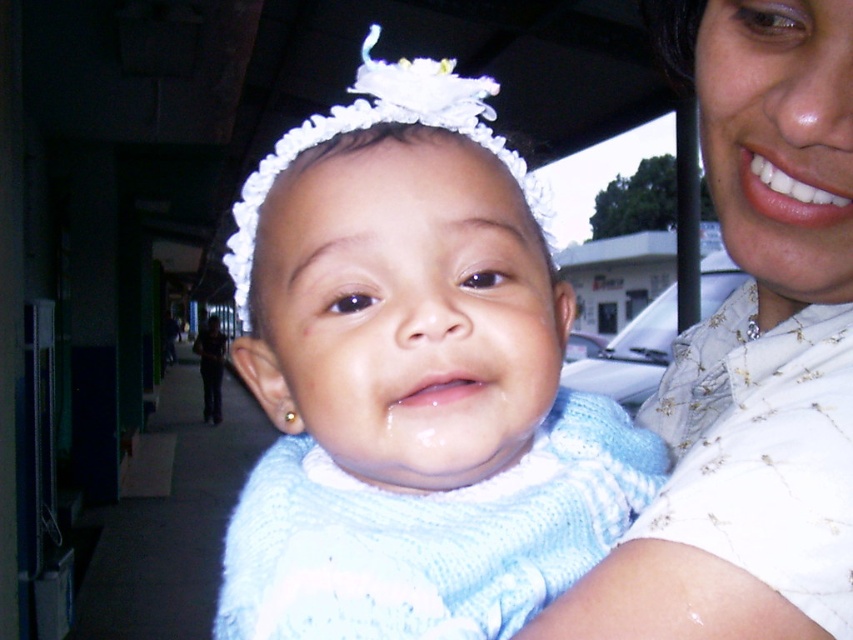
You are a photographer trying to capture the baby in focus while blurring the background. Since the light blue knitted sweater at center and the white quilted shirt at upper right are both in the scene, which one should you focus on to ensure the baby is sharp?

The light blue knitted sweater at center is in front of the white quilted shirt at upper right, so focusing on the light blue knitted sweater at center will keep the baby in sharp focus while blurring the background.

You are a photographer trying to capture a photo of the light blue knitted sweater at center and the white quilted shirt at upper right. Which object should you adjust your camera focus to first if you want to focus on the one closer to you?

The light blue knitted sweater at center is to the left of the white quilted shirt at upper right, but their distance from you isn

You are a photographer trying to capture the baby in the light blue knitted sweater at center. Where should you focus your camera to ensure the sweater is in sharp focus?

You should focus your camera at point (412, 381) to ensure the light blue knitted sweater at center is in sharp focus.